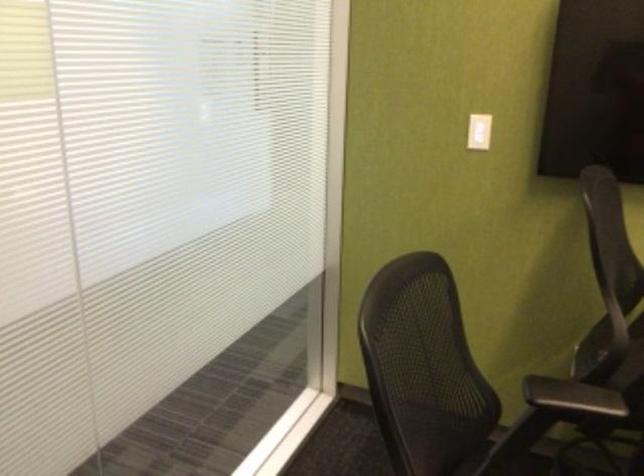
Find the location of a particular element. black chair armrest is located at coordinates (574, 398).